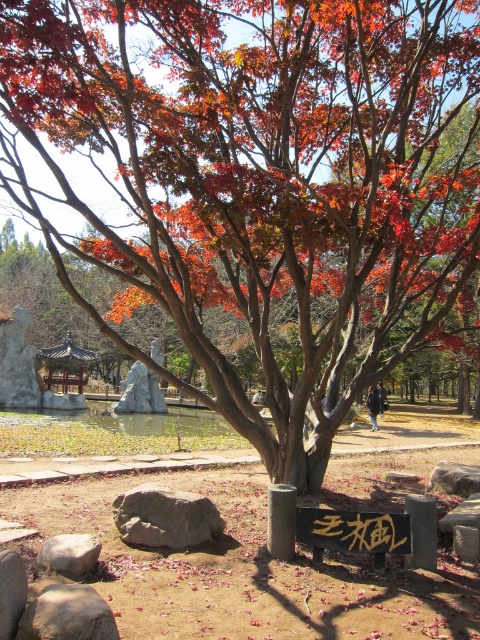
You are standing in the park and want to read the black stone sign at center. There is a gray rough stone at lower left nearby. Which object is higher up from the ground?

The black stone sign at center is above the gray rough stone at lower left, so the black stone sign at center is higher up from the ground.

You are a gardener who needs to place a new 5 meter long wooden bench between the gray rough rock at center and the tree. Is there enough space between them to place the bench?

The distance between the gray rough rock at center and the tree is 4.51 meters. Since the bench is 5 meters long, it is slightly too long to fit in the available space.